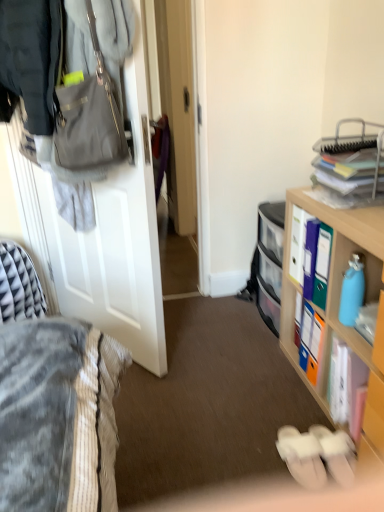
At what (x,y) coordinates should I click in order to perform the action: click on free location to the left of white fabric slippers at lower center, the first footwear from the left. Please return your answer as a coordinate pair (x, y). The image size is (384, 512). Looking at the image, I should click on click(x=245, y=460).